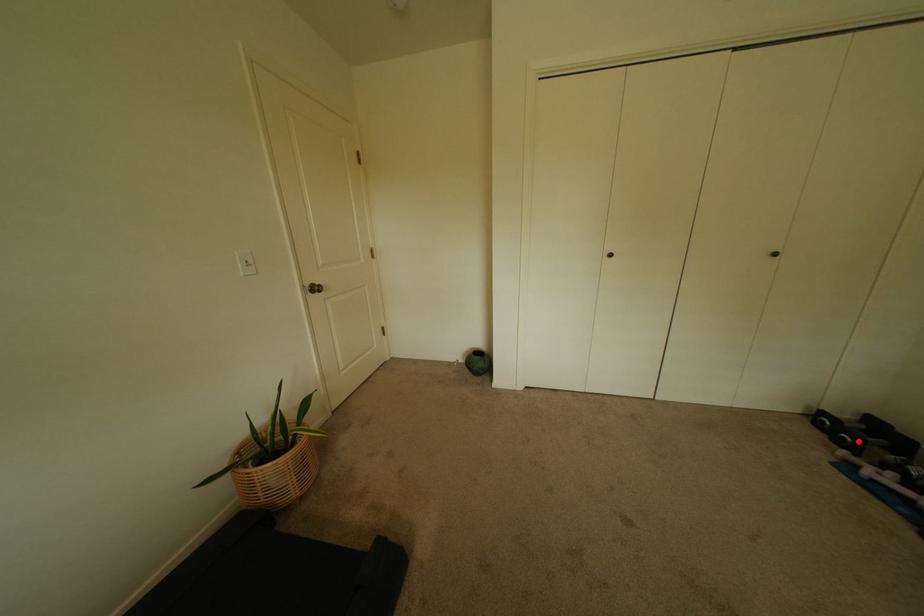
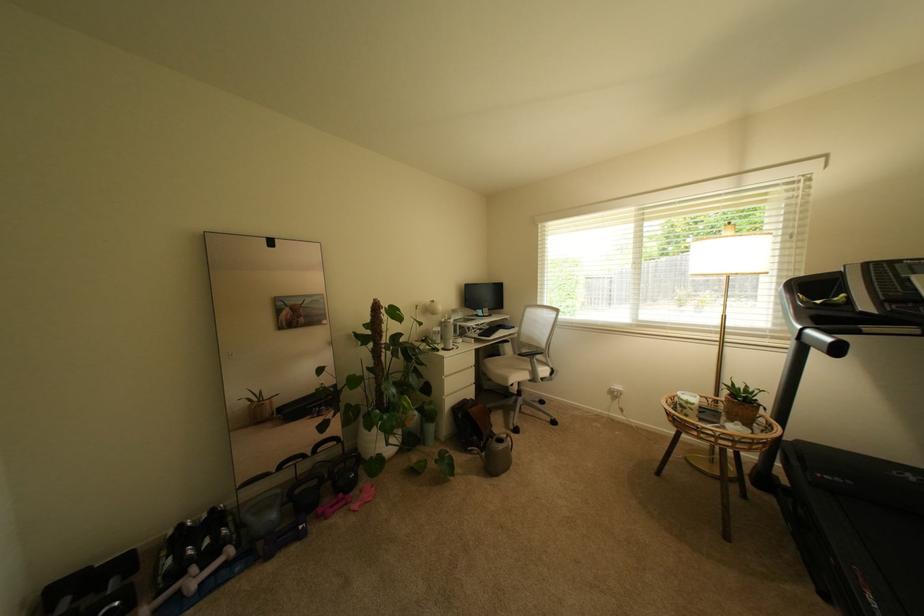
Question: I am providing you with two images of the same scene from different viewpoints. Given a red point in image1, look at the same physical point in image2. Is it:

Choices:
 (A) Closer to the viewpoint
 (B) Farther from the viewpoint

Answer: (A)